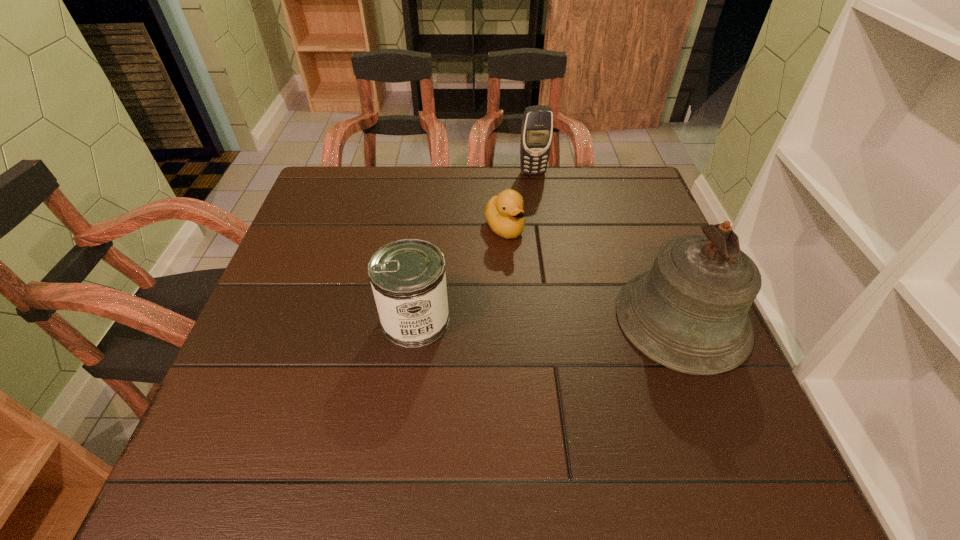
The image size is (960, 540). In the image, there is a desktop. Find the location of `blank space at the near edge`. blank space at the near edge is located at coordinates (360, 392).

In the image, there is a desktop. Where is `vacant space at the left edge`? vacant space at the left edge is located at coordinates (325, 261).

Where is `free space at the far left corner of the desktop`? free space at the far left corner of the desktop is located at coordinates (344, 198).

In the image, there is a desktop. Where is `vacant area at the far right corner`? The image size is (960, 540). vacant area at the far right corner is located at coordinates (596, 212).

What are the coordinates of `free spot between the bell and the can` in the screenshot? It's located at (549, 320).

At what (x,y) coordinates should I click in order to perform the action: click on free space between the bell and the second tallest object. Please return your answer as a coordinate pair (x, y). The image size is (960, 540). Looking at the image, I should click on (608, 246).

Find the location of a particular element. unoccupied area between the can and the third nearest object is located at coordinates (460, 274).

You are a GUI agent. You are given a task and a screenshot of the screen. Output one action in this format:
    pyautogui.click(x=<x>, y=<y>)
    Task: Click on the empty location between the rightmost object and the duckling
    The image size is (960, 540).
    Given the screenshot: What is the action you would take?
    click(593, 274)

Where is `free space between the cellular telephone and the bell`? free space between the cellular telephone and the bell is located at coordinates (608, 246).

I want to click on free spot between the rightmost object and the farthest object, so click(608, 246).